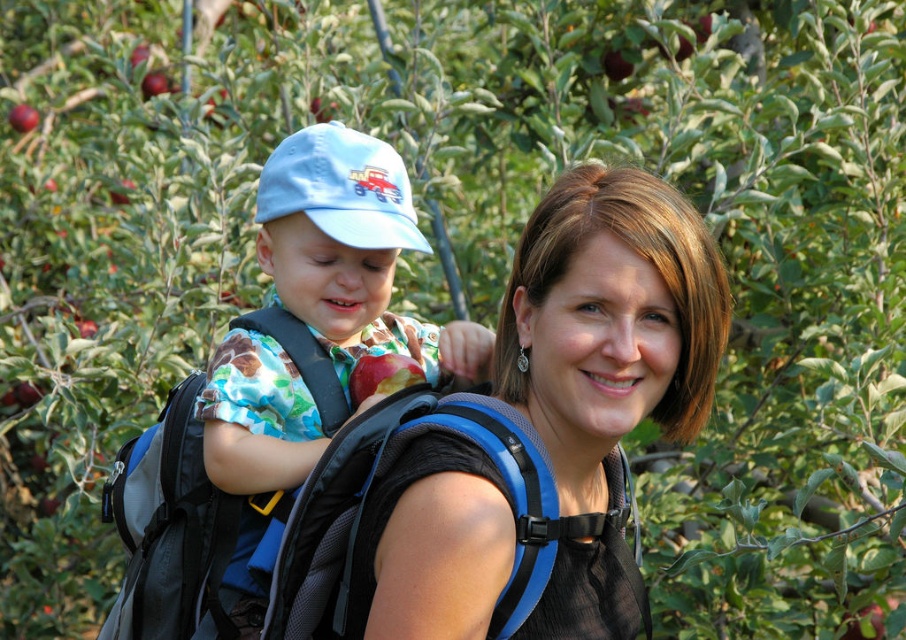
Which is more to the right, matte black backpack at center or matte blue cap at upper left?

matte black backpack at center is more to the right.

Between point (449, 636) and point (336, 236), which one is positioned behind?

The point (336, 236) is more distant.

Is point (570, 593) closer to camera compared to point (280, 362)?

Yes, point (570, 593) is closer to viewer.

Identify the location of matte black backpack at center. The image size is (906, 640). (606, 362).

Is point (266, 218) farther from viewer compared to point (350, 387)?

No, (266, 218) is closer to viewer.

Can you confirm if matte blue cap at upper left is bigger than red matte apple at center?

Correct, matte blue cap at upper left is larger in size than red matte apple at center.

Is point (285, 230) closer to camera compared to point (369, 380)?

Yes, it is in front of point (369, 380).

Locate an element on the screen. The image size is (906, 640). matte blue cap at upper left is located at coordinates (352, 252).

Is matte black backpack at center further to the viewer compared to red matte apple at center?

No, it is in front of red matte apple at center.

Is matte black backpack at center wider than red matte apple at center?

Yes.

Which is in front, point (470, 627) or point (360, 394)?

Positioned in front is point (470, 627).

At what (x,y) coordinates should I click in order to perform the action: click on matte black backpack at center. Please return your answer as a coordinate pair (x, y). The height and width of the screenshot is (640, 906). Looking at the image, I should click on (606, 362).